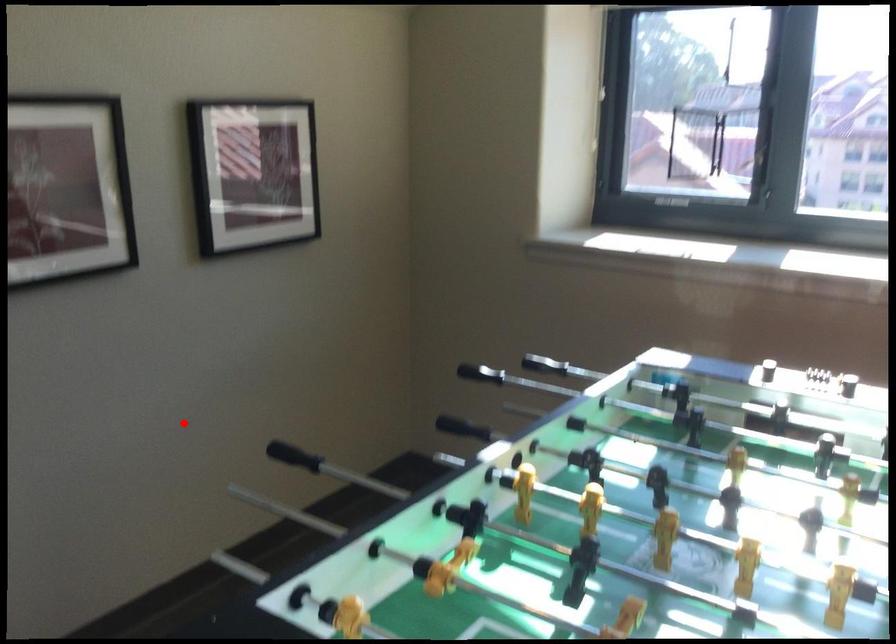
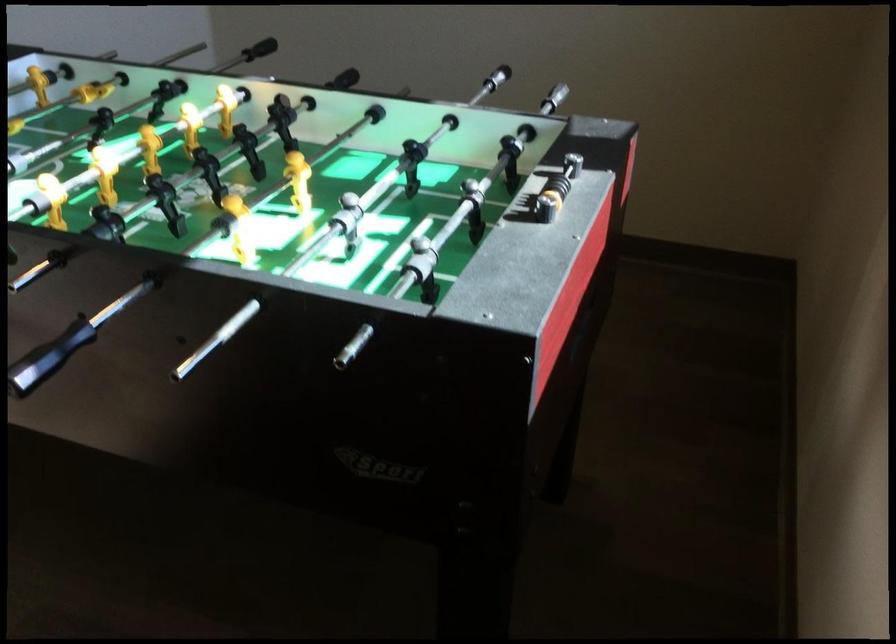
Where in the second image is the point corresponding to the highlighted location from the first image?

(496, 78)